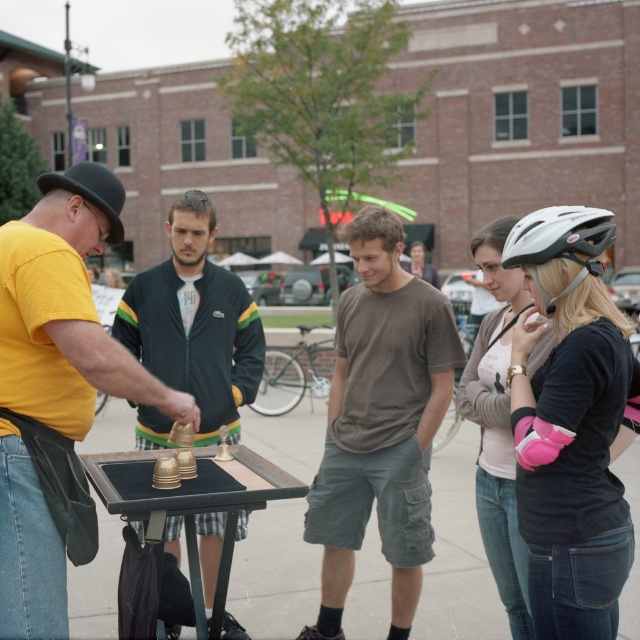
Between yellow matte shirt at left and white matte bicycle helmet at upper right, which one appears on the left side from the viewer's perspective?

From the viewer's perspective, yellow matte shirt at left appears more on the left side.

Can you confirm if yellow matte shirt at left is shorter than white matte bicycle helmet at upper right?

In fact, yellow matte shirt at left may be taller than white matte bicycle helmet at upper right.

The image size is (640, 640). Describe the element at coordinates (67, 308) in the screenshot. I see `yellow matte shirt at left` at that location.

Find the location of a particular element. The width and height of the screenshot is (640, 640). yellow matte shirt at left is located at coordinates (67, 308).

Who is positioned more to the right, yellow matte shirt at left or black jacket at center?

Positioned to the right is yellow matte shirt at left.

This screenshot has width=640, height=640. What do you see at coordinates (67, 308) in the screenshot?
I see `yellow matte shirt at left` at bounding box center [67, 308].

Find the location of a particular element. The height and width of the screenshot is (640, 640). yellow matte shirt at left is located at coordinates (67, 308).

Between brown cotton t-shirt at center and black jacket at center, which one appears on the right side from the viewer's perspective?

From the viewer's perspective, brown cotton t-shirt at center appears more on the right side.

Which is in front, point (422, 339) or point (179, 554)?

Point (422, 339) is in front.

Identify the location of brown cotton t-shirt at center. (380, 422).